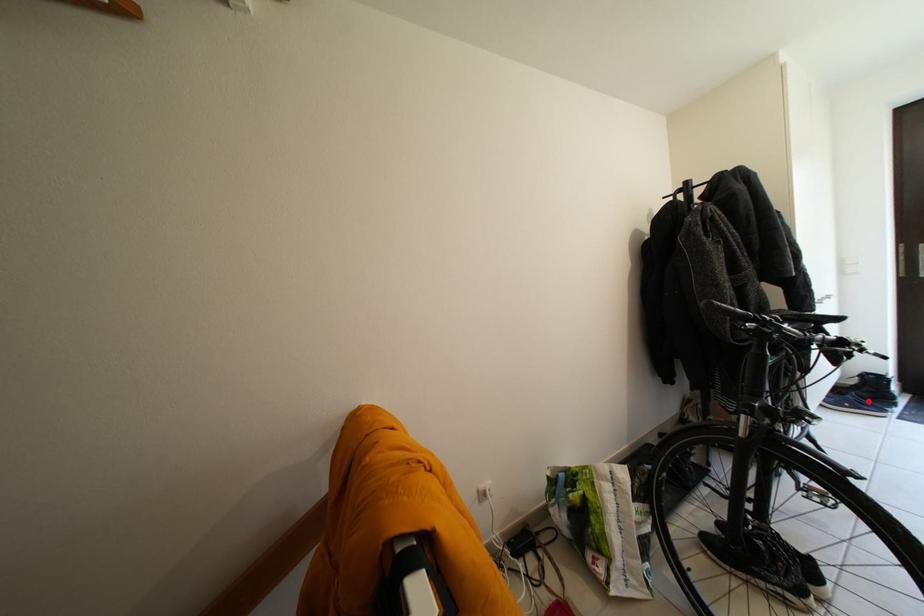
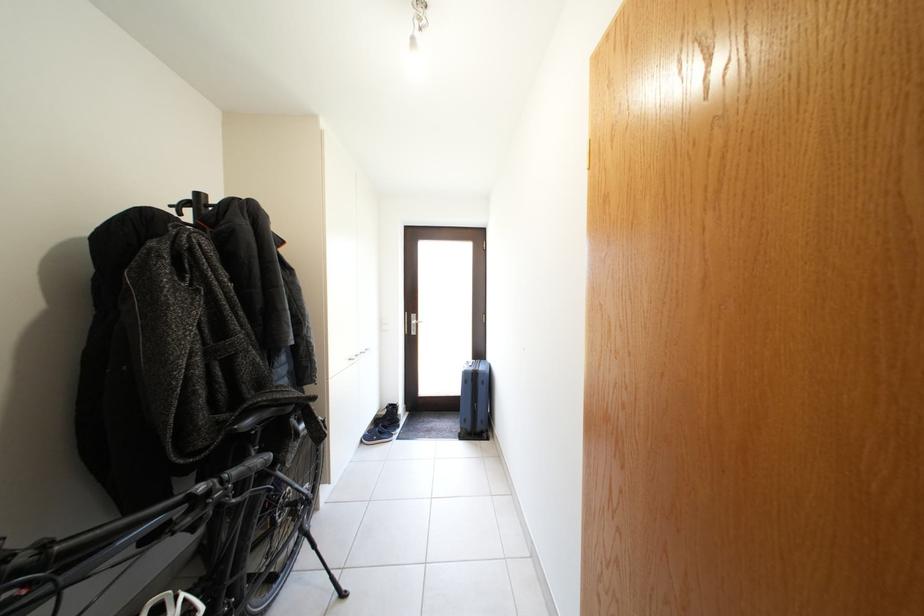
Question: I am providing you with two images of the same scene from different viewpoints. Image1 has a red point marked. In image2, the corresponding 3D location appears at what relative position? Reply with the corresponding letter.

Choices:
 (A) Closer
 (B) Farther

Answer: (B)